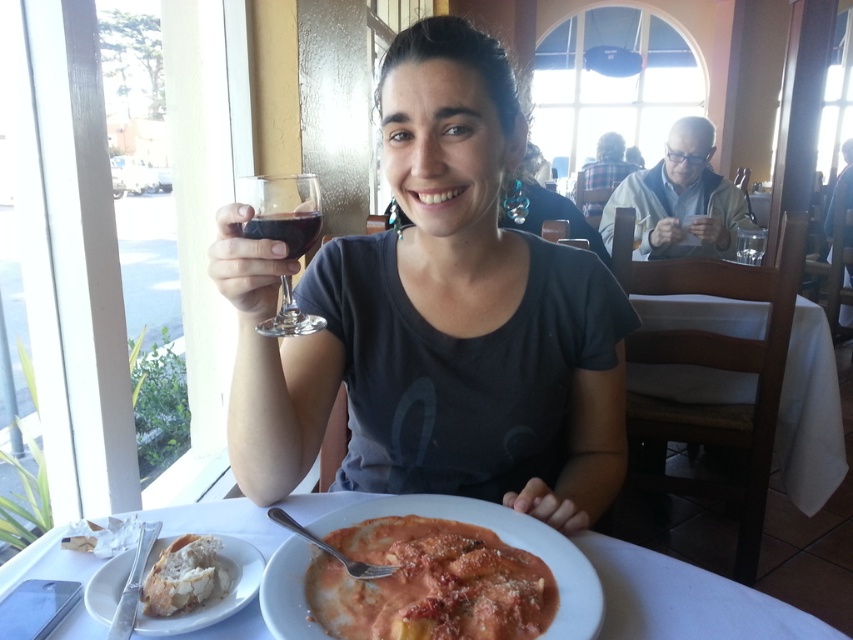
Question: Observing the image, what is the correct spatial positioning of matte glass at center in reference to transparent glass at upper center?

Choices:
 (A) above
 (B) below

Answer: (B)

Question: Which of the following is the farthest from the observer?

Choices:
 (A) transparent glass at upper center
 (B) translucent glass wine at upper center

Answer: (B)

Question: Does matte glass at center appear on the left side of translucent glass wine at upper center?

Choices:
 (A) no
 (B) yes

Answer: (A)

Question: Does white glossy plate at lower center appear on the left side of translucent glass wine at upper center?

Choices:
 (A) no
 (B) yes

Answer: (B)

Question: Which of the following is the closest to the observer?

Choices:
 (A) transparent glass at upper center
 (B) white matte plate at lower left
 (C) matte glass at center

Answer: (B)

Question: Which of these objects is positioned farthest from the white crusty bread at lower left?

Choices:
 (A) matte glass at center
 (B) white glossy plate at lower center
 (C) smooth creamy pasta at center
 (D) white matte plate at lower left

Answer: (A)